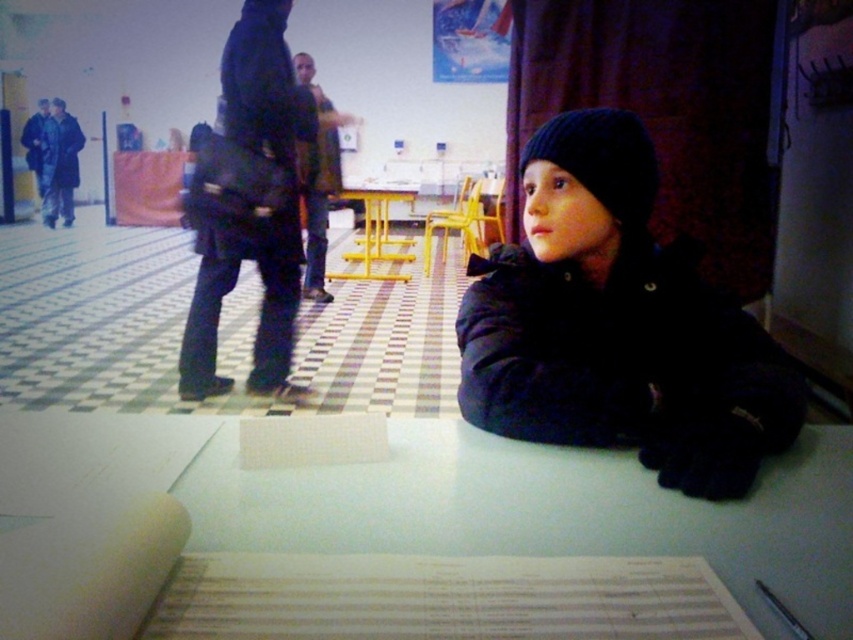
Question: Based on their relative distances, which object is nearer to the black knitted hat at center?

Choices:
 (A) black matte uniform at center
 (B) black knit hat at upper right
 (C) yellow metal table at center
 (D) white paper at center

Answer: (B)

Question: Which of these objects is positioned closest to the yellow metal table at center?

Choices:
 (A) black knitted hat at center
 (B) white paper at center
 (C) black knit hat at upper right
 (D) black matte uniform at center

Answer: (D)

Question: Among these objects, which one is farthest from the camera?

Choices:
 (A) white paper at center
 (B) black knit hat at upper right
 (C) black matte uniform at center
 (D) black knitted hat at center

Answer: (C)

Question: Is black matte uniform at center smaller than black knitted hat at center?

Choices:
 (A) yes
 (B) no

Answer: (B)

Question: Is white paper at center positioned in front of yellow metal table at center?

Choices:
 (A) no
 (B) yes

Answer: (B)

Question: Is white paper at center wider than black knitted hat at center?

Choices:
 (A) yes
 (B) no

Answer: (A)